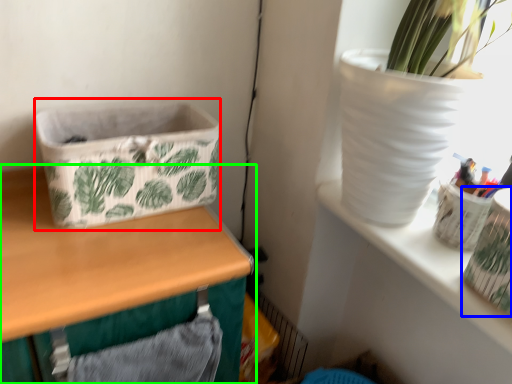
Question: Based on their relative distances, which object is nearer to basket container (highlighted by a red box)? Choose from vase (highlighted by a blue box) and table (highlighted by a green box).

Choices:
 (A) vase
 (B) table

Answer: (B)